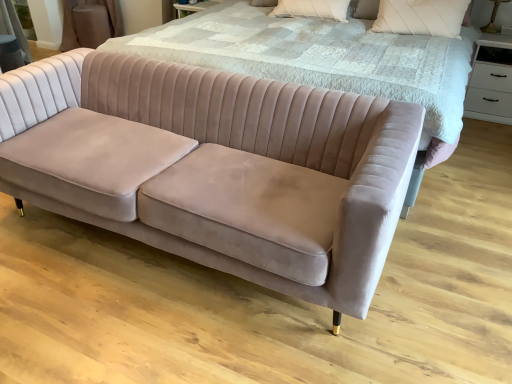
Locate an element on the screen. The height and width of the screenshot is (384, 512). vacant space that's between velvet beige couch at lower left and velvet bed at center is located at coordinates (399, 276).